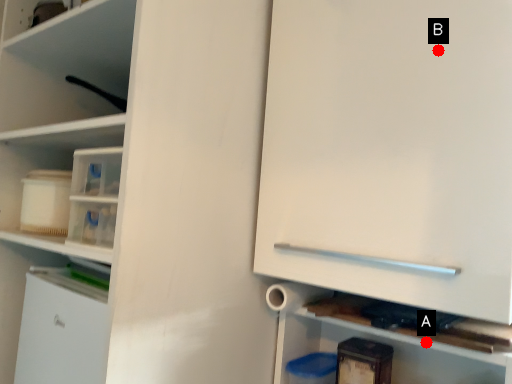
Question: Two points are circled on the image, labeled by A and B beside each circle. Which point is further to the camera?

Choices:
 (A) A is further
 (B) B is further

Answer: (A)